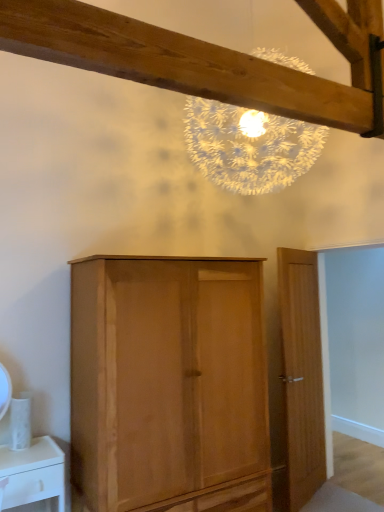
Question: From the image's perspective, is light brown wooden door at right located above or below light brown wood cupboard at center?

Choices:
 (A) below
 (B) above

Answer: (B)

Question: Is point (284, 248) closer or farther from the camera than point (119, 501)?

Choices:
 (A) closer
 (B) farther

Answer: (B)

Question: From their relative heights in the image, would you say light brown wooden door at right is taller or shorter than light brown wood cupboard at center?

Choices:
 (A) short
 (B) tall

Answer: (B)

Question: Is light brown wood cupboard at center taller or shorter than light brown wooden door at right?

Choices:
 (A) tall
 (B) short

Answer: (B)

Question: Visually, is light brown wood cupboard at center positioned to the left or to the right of light brown wooden door at right?

Choices:
 (A) right
 (B) left

Answer: (B)

Question: Does point (155, 436) appear closer or farther from the camera than point (294, 441)?

Choices:
 (A) farther
 (B) closer

Answer: (B)

Question: Do you think light brown wood cupboard at center is within light brown wooden door at right, or outside of it?

Choices:
 (A) outside
 (B) inside

Answer: (A)